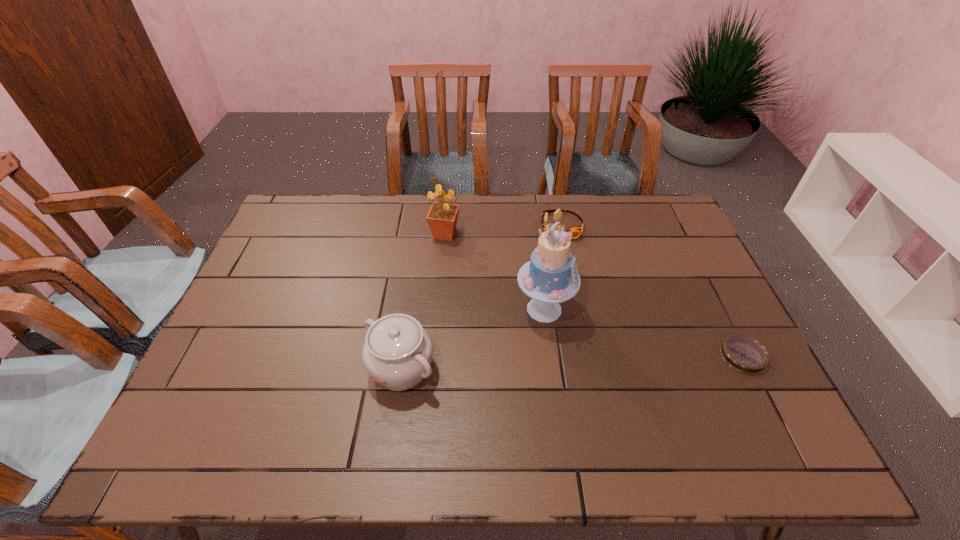
The height and width of the screenshot is (540, 960). What are the coordinates of `unoccupied area between the second tallest object and the chinaware` in the screenshot? It's located at (423, 301).

Identify the location of free spot between the third shortest object and the compass. (572, 362).

Identify the location of unoccupied position between the chinaware and the third farthest object. (472, 339).

The width and height of the screenshot is (960, 540). Find the location of `vacant region between the third shortest object and the goggles`. vacant region between the third shortest object and the goggles is located at coordinates (481, 297).

You are a GUI agent. You are given a task and a screenshot of the screen. Output one action in this format:
    pyautogui.click(x=<x>, y=<y>)
    Task: Click on the empty space between the third tallest object and the sunflower
    The width and height of the screenshot is (960, 540).
    Given the screenshot: What is the action you would take?
    pyautogui.click(x=423, y=301)

The image size is (960, 540). Identify the location of unoccupied area between the second tallest object and the rightmost object. (594, 295).

Identify the location of object that stands as the third closest to the shortest object. (397, 353).

I want to click on the third closest object to the fourth tallest object, so (744, 354).

This screenshot has height=540, width=960. What are the coordinates of `free space that satisfies the following two spatial constraints: 1. on the back side of the third tallest object; 2. on the left side of the goggles` in the screenshot? It's located at (422, 226).